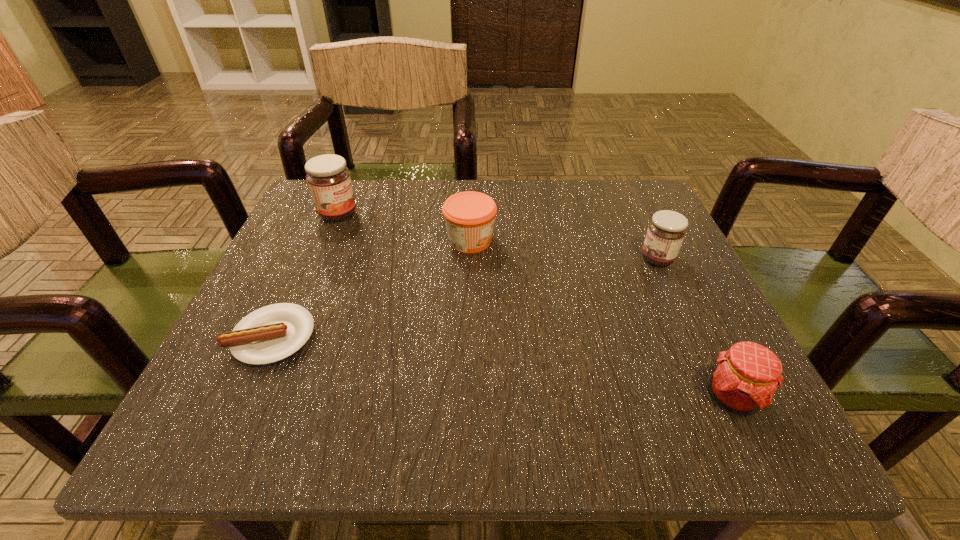
At what (x,y) coordinates should I click in order to perform the action: click on jam that stands as the closest to the tallest jam. Please return your answer as a coordinate pair (x, y). The image size is (960, 540). Looking at the image, I should click on (469, 216).

I want to click on jam that is the third closest one to the third object from right to left, so click(745, 378).

What are the coordinates of `vacant region that satisfies the following two spatial constraints: 1. on the front label of the second jam from left to right; 2. on the left side of the nearest jam` in the screenshot? It's located at (466, 397).

Image resolution: width=960 pixels, height=540 pixels. Find the location of `vacant space that satisfies the following two spatial constraints: 1. on the front side of the nearest object; 2. on the left side of the tallest jam`. vacant space that satisfies the following two spatial constraints: 1. on the front side of the nearest object; 2. on the left side of the tallest jam is located at coordinates (260, 397).